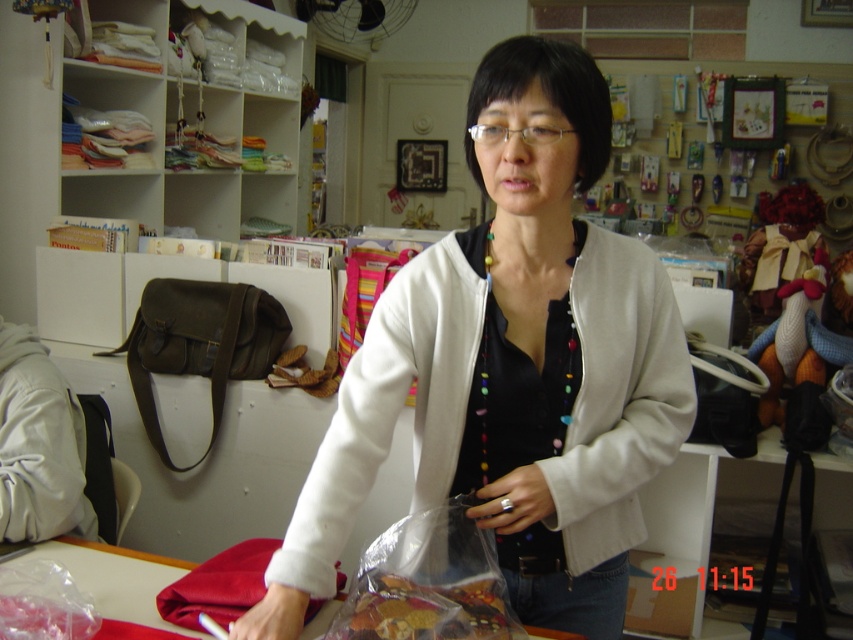
You are a customer in a craft store and see the olive green leather bag at left and the translucent plastic bag of dried fruits at center. Which object is taller?

The olive green leather bag at left is taller than the translucent plastic bag of dried fruits at center.

You are a delivery person who needs to place a small package between the white matte jacket at center and the olive green leather bag at left. The package is 2 feet long. Is there enough space between them to fit the package?

The white matte jacket at center is 4.46 feet from the olive green leather bag at left, so yes, the package can be placed between them since the distance is greater than the package length.

You are a tailor trying to decide which item to place on a narrow shelf that can only accommodate items up to the width of the olive green leather bag at left. Can the white matte jacket at center fit on this shelf?

The white matte jacket at center is wider than the olive green leather bag at left, so it cannot fit on the shelf designed for items up to the bag width.